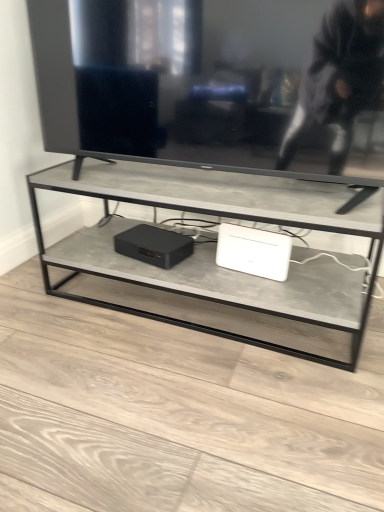
Question: From their relative heights in the image, would you say matte black device at center, which is counted as the 2th computer, starting from the right, is taller or shorter than white plastic router at center, which ranks as the first computer in right-to-left order?

Choices:
 (A) tall
 (B) short

Answer: (B)

Question: Is matte black device at center, which is counted as the 2th computer, starting from the right, bigger or smaller than white plastic router at center, which appears as the second computer when viewed from the left?

Choices:
 (A) big
 (B) small

Answer: (A)

Question: Is point (160, 245) closer or farther from the camera than point (271, 234)?

Choices:
 (A) farther
 (B) closer

Answer: (A)

Question: Considering their positions, is white plastic router at center, which appears as the second computer when viewed from the left, located in front of or behind matte black device at center, which is counted as the 2th computer, starting from the right?

Choices:
 (A) behind
 (B) front

Answer: (B)

Question: Would you say white plastic router at center, which ranks as the first computer in right-to-left order, is inside or outside matte black device at center, which is counted as the 2th computer, starting from the right?

Choices:
 (A) inside
 (B) outside

Answer: (B)

Question: Does point (261, 267) appear closer or farther from the camera than point (173, 232)?

Choices:
 (A) closer
 (B) farther

Answer: (A)

Question: In terms of width, does white plastic router at center, which appears as the second computer when viewed from the left, look wider or thinner when compared to matte black device at center, the first computer positioned from the left?

Choices:
 (A) wide
 (B) thin

Answer: (B)